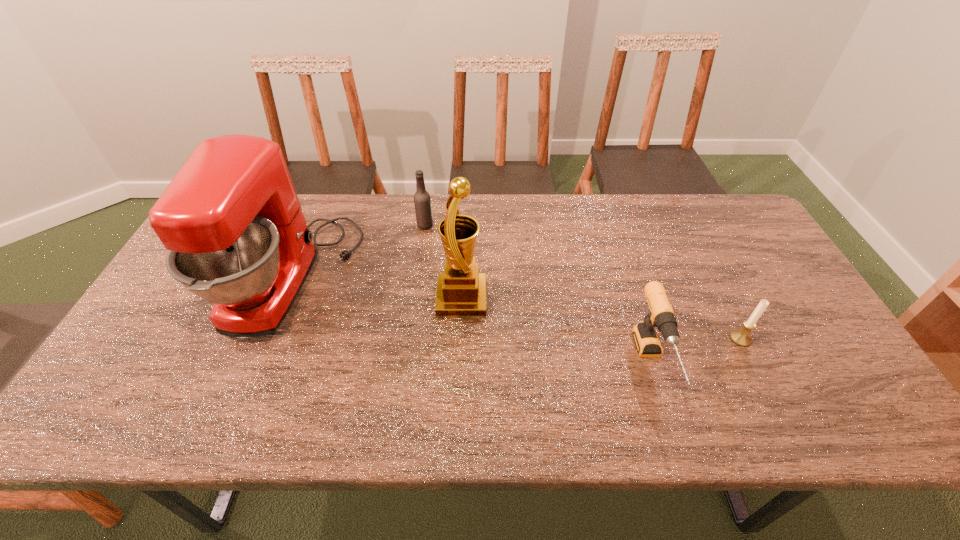
Where is `vacant point located between the award and the drill`? The height and width of the screenshot is (540, 960). vacant point located between the award and the drill is located at coordinates (557, 331).

This screenshot has height=540, width=960. Identify the location of free space between the second object from right to left and the award. [x=557, y=331].

Locate an element on the screen. free space between the award and the second object from right to left is located at coordinates (557, 331).

Locate an element on the screen. The width and height of the screenshot is (960, 540). free space between the rightmost object and the fourth object from left to right is located at coordinates (x=696, y=352).

Locate an element on the screen. The width and height of the screenshot is (960, 540). empty location between the third object from left to right and the drill is located at coordinates (557, 331).

I want to click on vacant space that's between the kitchen mixer and the drill, so click(x=472, y=322).

Find the location of a particular element. The image size is (960, 540). vacant region between the leftmost object and the candle holder is located at coordinates (516, 309).

At what (x,y) coordinates should I click in order to perform the action: click on vacant space that's between the third shortest object and the candle holder. Please return your answer as a coordinate pair (x, y). The image size is (960, 540). Looking at the image, I should click on (583, 282).

Find the location of a particular element. This screenshot has width=960, height=540. vacant area that lies between the drill and the candle holder is located at coordinates (696, 352).

Find the location of a particular element. The width and height of the screenshot is (960, 540). vacant point located between the rightmost object and the leftmost object is located at coordinates (516, 309).